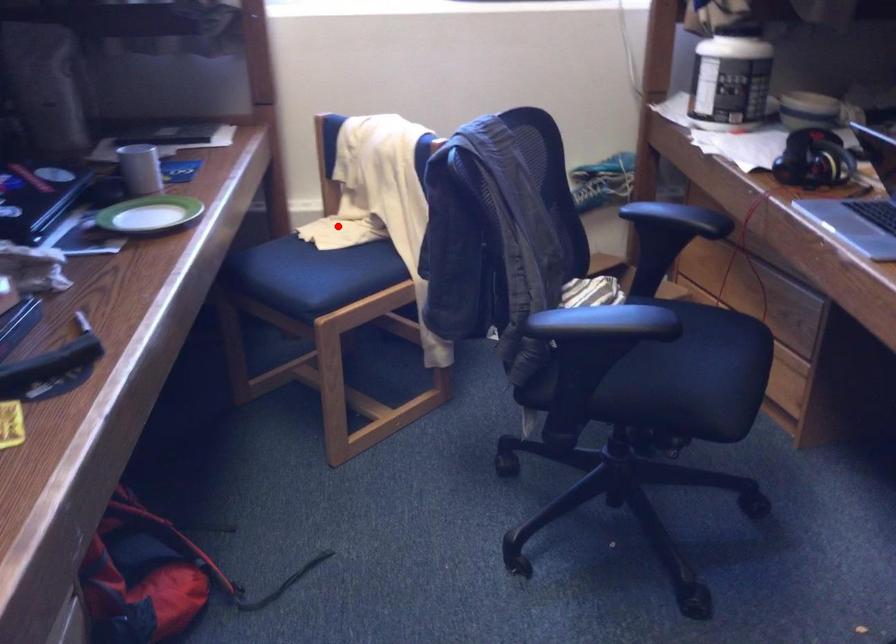
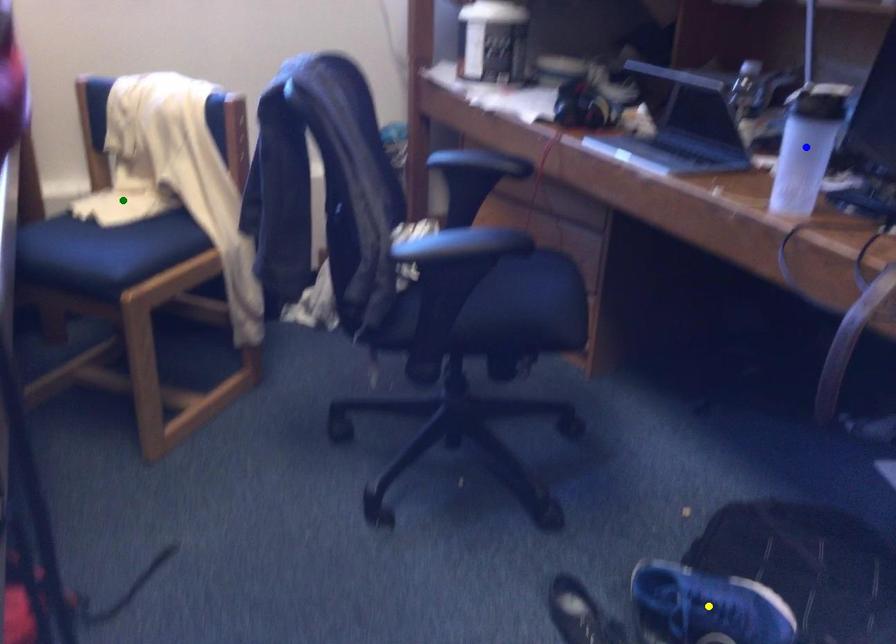
Question: I am providing you with two images of the same scene from different viewpoints. A red point is marked on the first image. You are given multiple points on the second image. Can you choose the point in image 2 that corresponds to the point in image 1?

Choices:
 (A) blue point
 (B) yellow point
 (C) green point

Answer: (C)